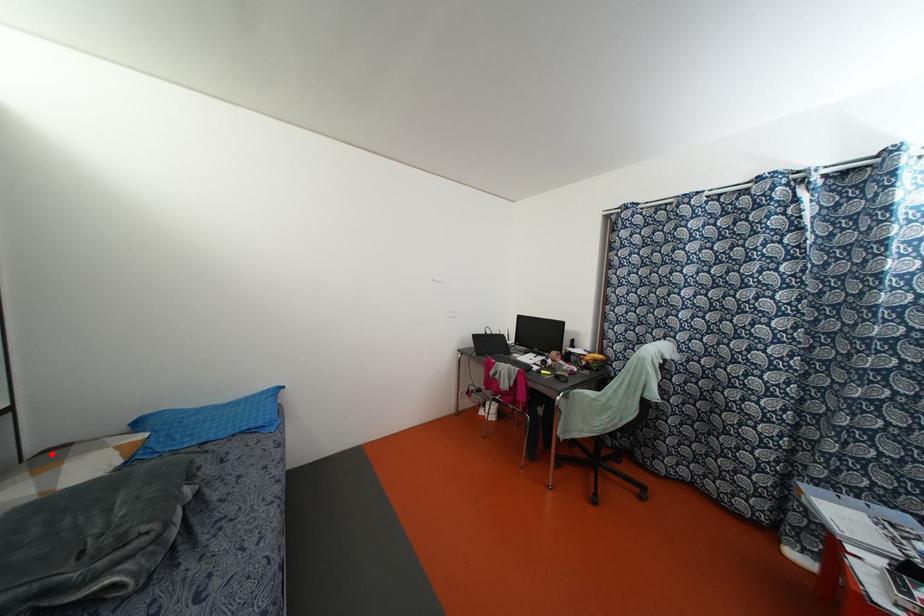
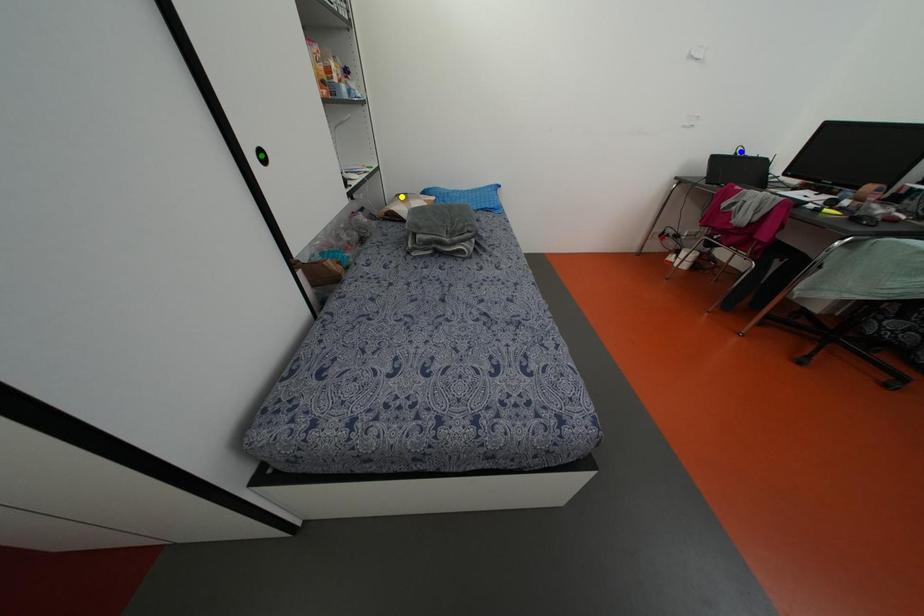
Question: I am providing you with two images of the same scene from different viewpoints. A red point is marked on the first image. You are given multiple points on the second image. Which point in image 2 represents the same 3d spot as the red point in image 1?

Choices:
 (A) blue point
 (B) yellow point
 (C) green point

Answer: (B)